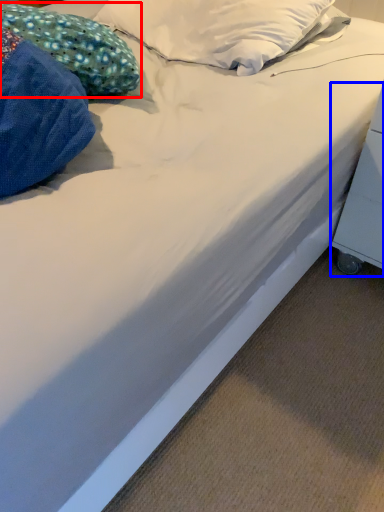
Question: Which of the following is the farthest to the observer, pillow (highlighted by a red box) or table (highlighted by a blue box)?

Choices:
 (A) pillow
 (B) table

Answer: (A)